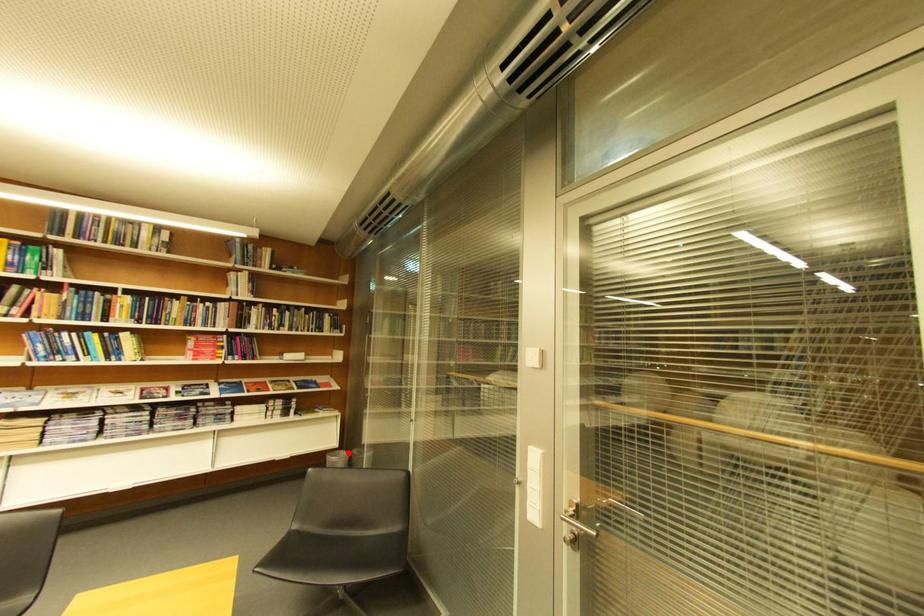
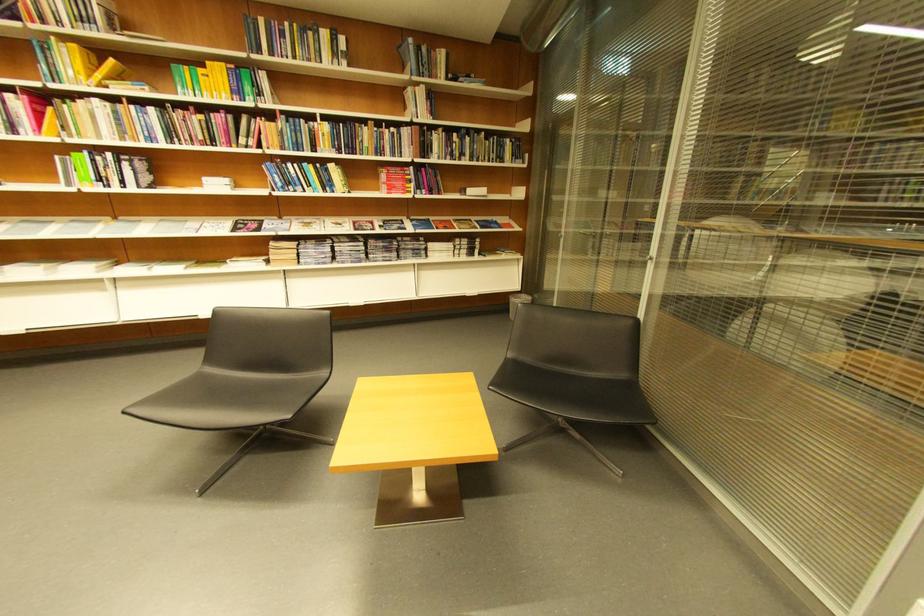
Question: I am providing you with two images of the same scene from different viewpoints. A red point is shown in image1. For the corresponding object point in image2, is it positioned nearer or farther from the camera?

Choices:
 (A) Nearer
 (B) Farther

Answer: (A)